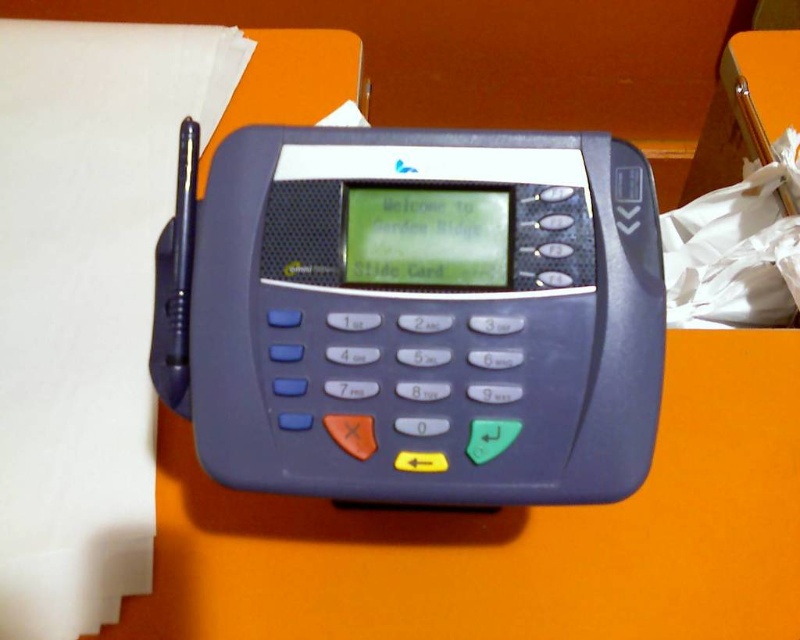
You are standing in front of the payment terminal and need to press two points on it. The first point is at coordinates point [518,289] and the second is at point [121,326]. Which point should you press first if you want to press the one closer to you first?

You should press point [518,289] first because it is closer to you than point [121,326] according to the description.

You are at a payment terminal and need to place your receipt. The orange matte table at center and the white paper at left are available. Which one is on the left side?

The white paper at left is on the left side as it is positioned to the left of the orange matte table at center.

You are at a payment terminal on a bright orange surface. You need to place a matte plastic card reader at center and a white paper at left. Where should you position them according to the scene?

The matte plastic card reader at center should be placed below the white paper at left as described in the scene.